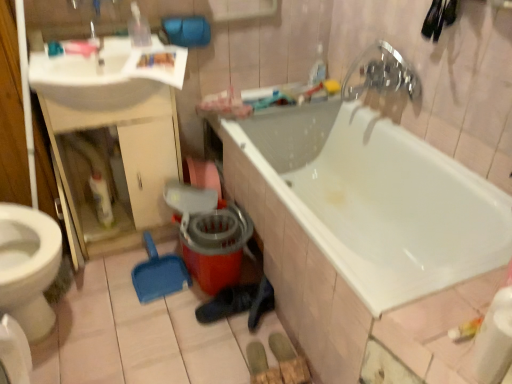
Question: From the image's perspective, is white glossy bathtub at center beneath white glossy sink at upper left?

Choices:
 (A) no
 (B) yes

Answer: (B)

Question: Is white glossy bathtub at center at the left side of white glossy sink at upper left?

Choices:
 (A) no
 (B) yes

Answer: (A)

Question: Can we say white glossy bathtub at center lies outside white glossy sink at upper left?

Choices:
 (A) no
 (B) yes

Answer: (B)

Question: Is white glossy bathtub at center behind white glossy sink at upper left?

Choices:
 (A) no
 (B) yes

Answer: (A)

Question: Is white glossy bathtub at center looking in the opposite direction of white glossy sink at upper left?

Choices:
 (A) no
 (B) yes

Answer: (A)

Question: Considering the relative sizes of white glossy bathtub at center and white glossy sink at upper left in the image provided, is white glossy bathtub at center taller than white glossy sink at upper left?

Choices:
 (A) yes
 (B) no

Answer: (A)

Question: Can you confirm if white glossy sink at upper left is positioned to the left of chrome metallic faucet at upper right?

Choices:
 (A) yes
 (B) no

Answer: (A)

Question: Does white glossy sink at upper left appear on the right side of chrome metallic faucet at upper right?

Choices:
 (A) no
 (B) yes

Answer: (A)

Question: Does white glossy sink at upper left have a lesser height compared to chrome metallic faucet at upper right?

Choices:
 (A) yes
 (B) no

Answer: (A)

Question: Does white glossy sink at upper left turn towards chrome metallic faucet at upper right?

Choices:
 (A) yes
 (B) no

Answer: (B)

Question: Does white glossy sink at upper left have a smaller size compared to chrome metallic faucet at upper right?

Choices:
 (A) yes
 (B) no

Answer: (B)

Question: Does white glossy sink at upper left contain chrome metallic faucet at upper right?

Choices:
 (A) no
 (B) yes

Answer: (A)

Question: Is chrome metallic faucet at upper right closer to the viewer compared to white glossy sink at upper left?

Choices:
 (A) no
 (B) yes

Answer: (A)